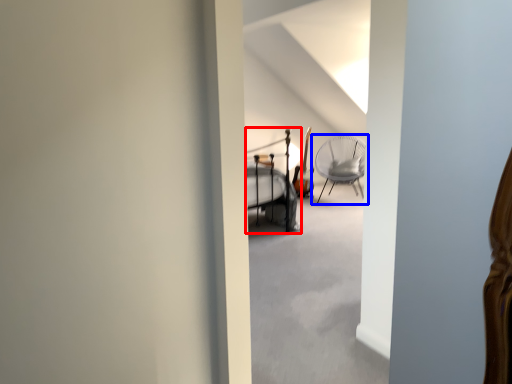
Question: Which object appears farthest to the camera in this image, bunk bed (highlighted by a red box) or chair (highlighted by a blue box)?

Choices:
 (A) bunk bed
 (B) chair

Answer: (B)